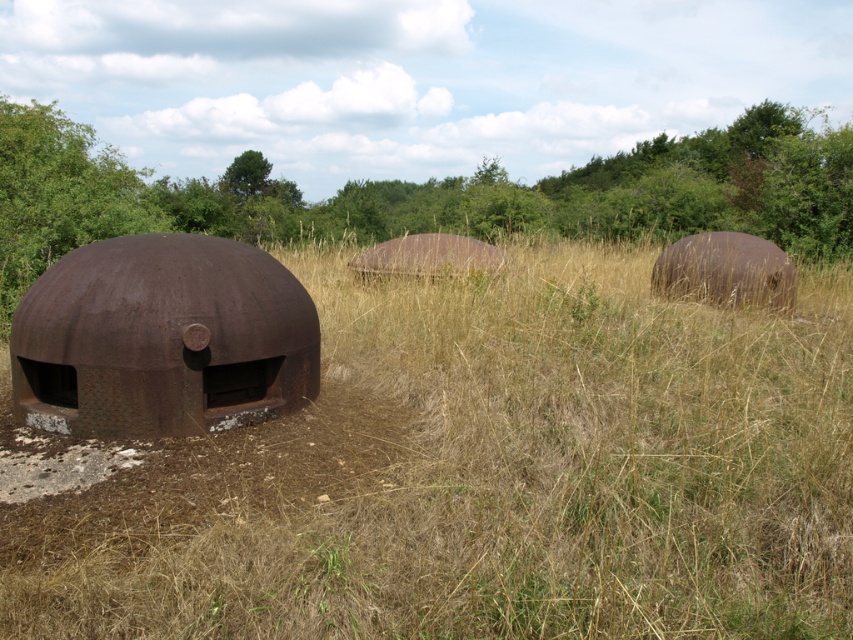
You are a photographer wanting to capture a wide shot of the green leafy tree at upper center and the rusty metal bunker at left. Based on the scene description, which object might require a wider angle lens to fully capture in the frame?

The green leafy tree at upper center might require a wider angle lens because it might be wider than the rusty metal bunker at left according to the description.

You are a photographer standing in front of the three rusted dome structures. You want to capture a photo that includes both the brown dry grass at center and the green leafy tree at upper center. Based on their positions, which object will appear larger in the photo?

The brown dry grass at center appears larger in the photo because it is closer to the viewer than the green leafy tree at upper center.